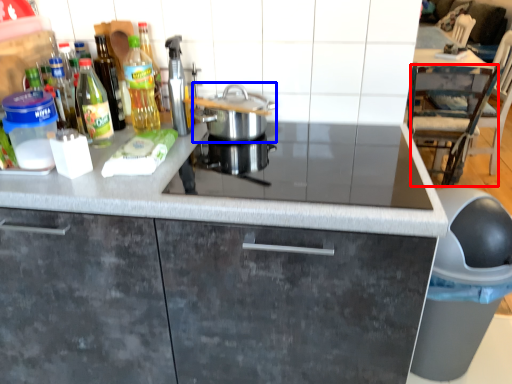
Question: Which object appears closest to the camera in this image, chair (highlighted by a red box) or kitchen appliance (highlighted by a blue box)?

Choices:
 (A) chair
 (B) kitchen appliance

Answer: (B)